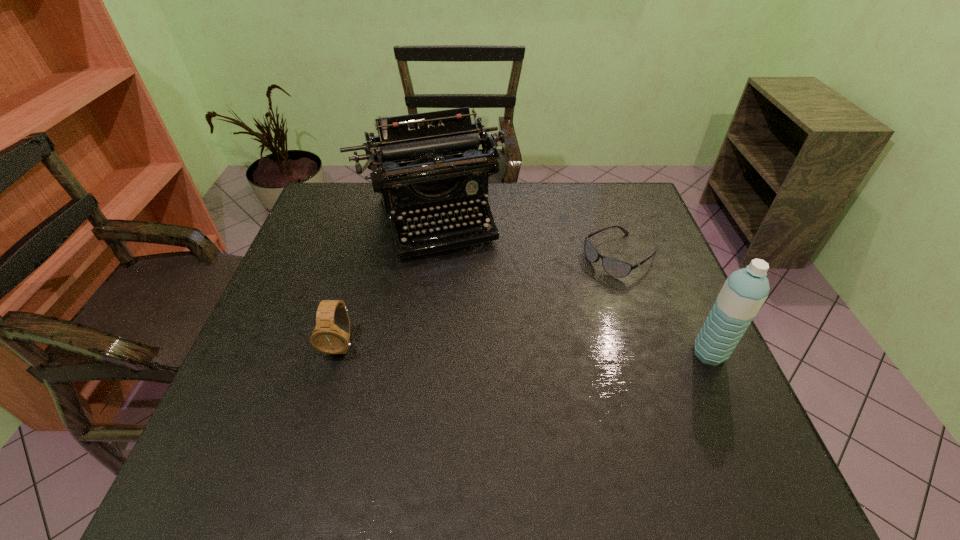
Image resolution: width=960 pixels, height=540 pixels. In order to click on watch in this screenshot , I will do `click(331, 335)`.

At what (x,y) coordinates should I click in order to perform the action: click on water bottle. Please return your answer as a coordinate pair (x, y). Image resolution: width=960 pixels, height=540 pixels. Looking at the image, I should click on (744, 292).

Identify the location of sunglasses. This screenshot has width=960, height=540. click(x=613, y=267).

Find the location of a particular element. The height and width of the screenshot is (540, 960). typewriter is located at coordinates (430, 160).

Locate an element on the screen. The height and width of the screenshot is (540, 960). vacant region located on the face of the watch is located at coordinates (319, 424).

Where is `vacant space situated 0.210m on the back of the water bottle`? vacant space situated 0.210m on the back of the water bottle is located at coordinates (675, 278).

Locate an element on the screen. vacant area located on the lenses of the sunglasses is located at coordinates (565, 291).

Identify the location of free spot located on the lenses of the sunglasses. (584, 280).

Where is `vacant space situated on the lenses of the sunglasses`? vacant space situated on the lenses of the sunglasses is located at coordinates (581, 281).

Find the location of a particular element. The image size is (960, 540). vacant region located 0.340m on the keyboard of the typewriter is located at coordinates (482, 359).